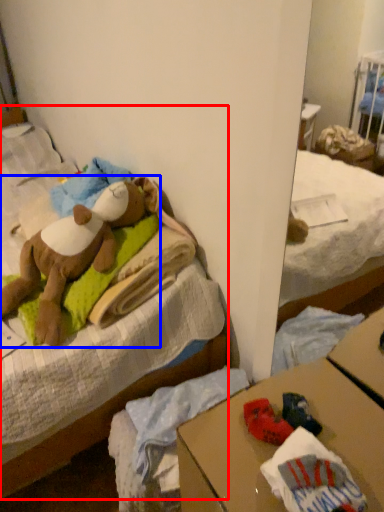
Question: Among these objects, which one is nearest to the camera, bed (highlighted by a red box) or teddy bear (highlighted by a blue box)?

Choices:
 (A) bed
 (B) teddy bear

Answer: (A)